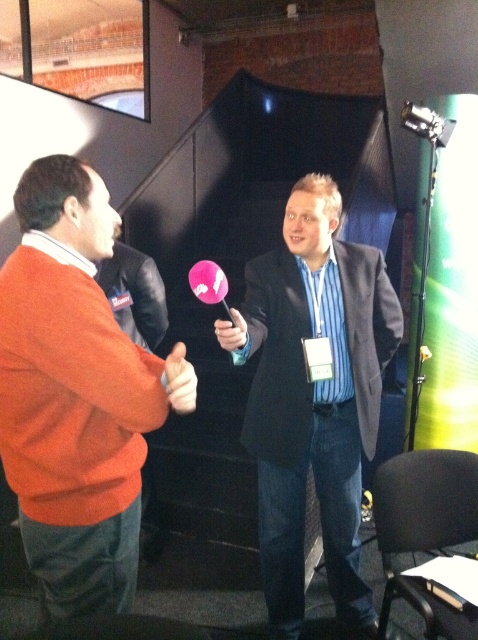
You are designing a seating arrangement for an event and need to place two chairs side by side for the people wearing the orange sweater at left and the black leather jacket at left. The chairs are standard width. Which person might need a wider chair to accommodate their clothing?

The orange sweater at left requires a wider chair because its width is larger than the black leather jacket at left.

You are standing in front of the interview scene and want to determine which of the two points, point (150, 266) or point (422, 120), is nearer to you. Based on the spatial arrangement in the image, which point is closer?

Point (150, 266) is closer to the viewer than point (422, 120).